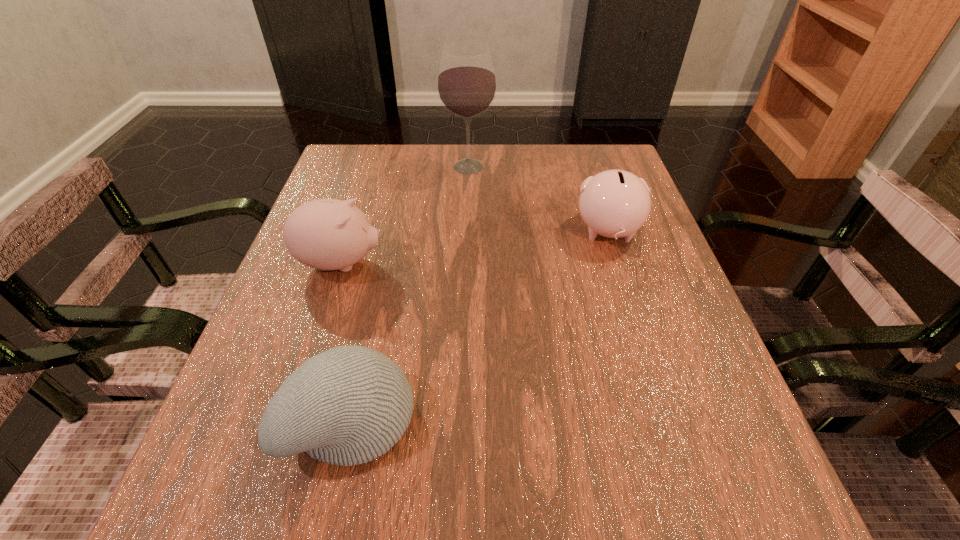
Find the location of a particular element. the tallest object is located at coordinates (466, 82).

Identify the location of the farthest object. The image size is (960, 540). (466, 82).

At what (x,y) coordinates should I click in order to perform the action: click on the left piggy bank. Please return your answer as a coordinate pair (x, y). This screenshot has width=960, height=540. Looking at the image, I should click on (327, 234).

Where is `the rightmost object`? the rightmost object is located at coordinates tap(615, 203).

You are a GUI agent. You are given a task and a screenshot of the screen. Output one action in this format:
    pyautogui.click(x=<x>, y=<y>)
    Task: Click on the nearest object
    
    Given the screenshot: What is the action you would take?
    pyautogui.click(x=348, y=405)

The image size is (960, 540). Identify the location of vacant space located on the front of the alcohol. (468, 198).

Where is `vacant region located 0.210m at the snout of the left piggy bank`? vacant region located 0.210m at the snout of the left piggy bank is located at coordinates (487, 263).

Identify the location of vacant area situated on the front of the right piggy bank. The width and height of the screenshot is (960, 540). (630, 301).

Find the location of a particular element. This screenshot has width=960, height=540. blank area located 0.250m on the right of the beanie is located at coordinates (581, 417).

Locate an element on the screen. object present at the far edge is located at coordinates (466, 82).